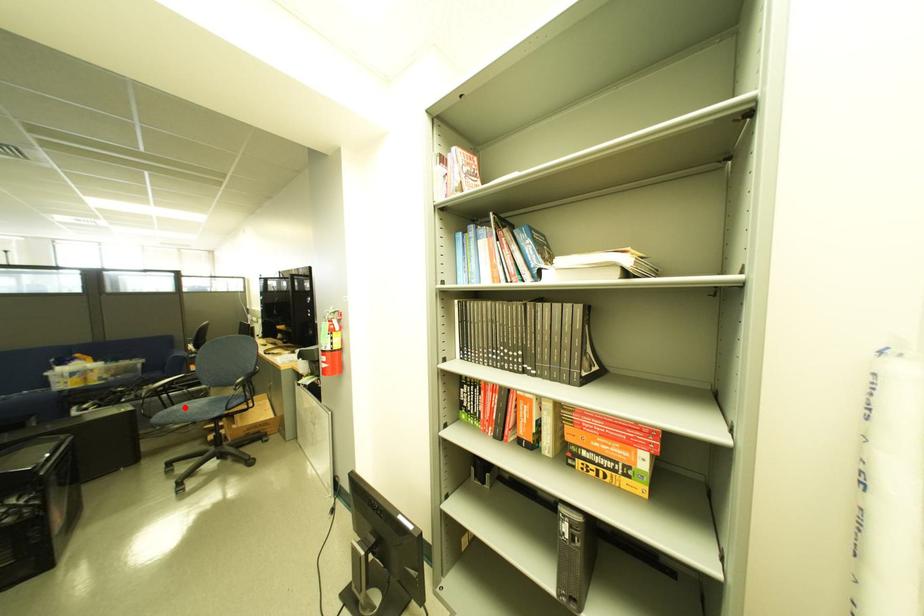
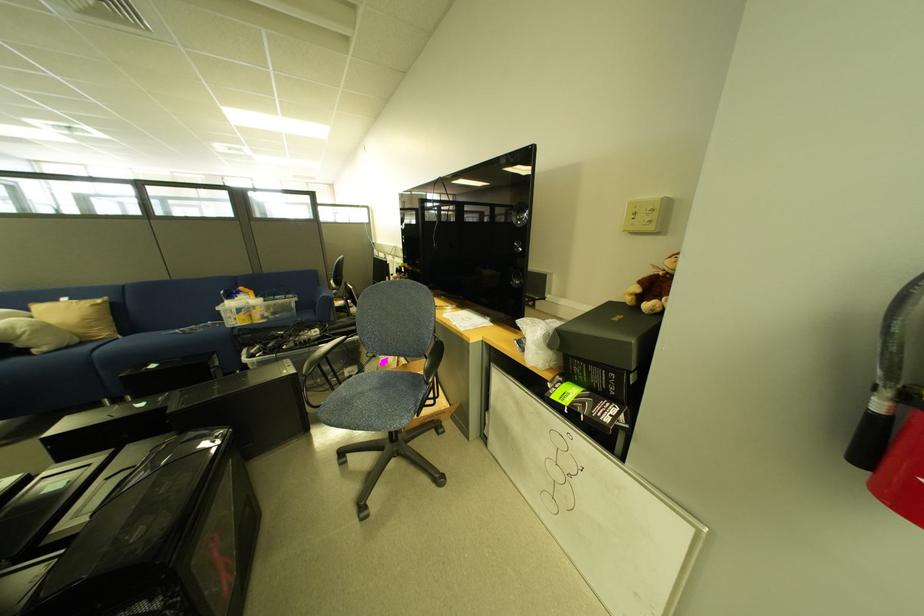
In the second image, find the point that corresponds to the highlighted location in the first image.

(350, 386)